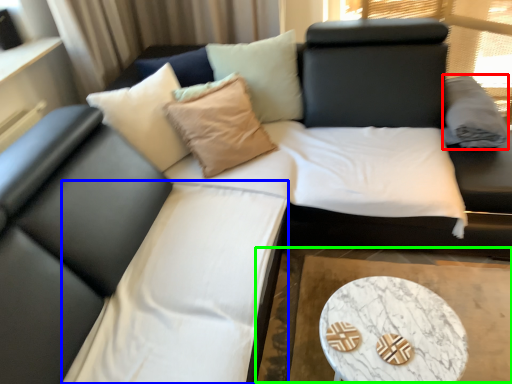
Question: Estimate the real-world distances between objects in this image. Which object is farther from pillow (highlighted by a red box), bedding (highlighted by a blue box) or cocktail table (highlighted by a green box)?

Choices:
 (A) bedding
 (B) cocktail table

Answer: (A)